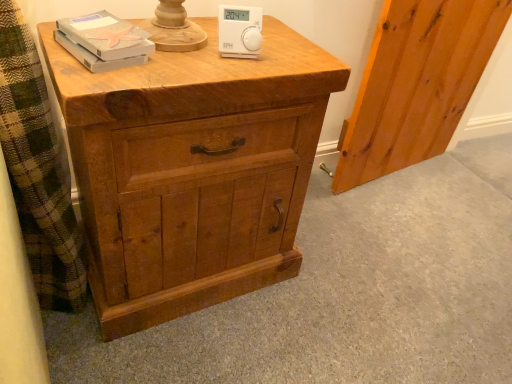
Question: Considering the relative sizes of matte gray book at upper left and white plastic thermostat at upper center in the image provided, is matte gray book at upper left shorter than white plastic thermostat at upper center?

Choices:
 (A) no
 (B) yes

Answer: (B)

Question: From a real-world perspective, is matte gray book at upper left located higher than white plastic thermostat at upper center?

Choices:
 (A) yes
 (B) no

Answer: (B)

Question: From the image's perspective, is matte gray book at upper left located beneath white plastic thermostat at upper center?

Choices:
 (A) no
 (B) yes

Answer: (B)

Question: Considering the relative sizes of matte gray book at upper left and white plastic thermostat at upper center in the image provided, is matte gray book at upper left thinner than white plastic thermostat at upper center?

Choices:
 (A) no
 (B) yes

Answer: (A)

Question: Considering the relative sizes of matte gray book at upper left and white plastic thermostat at upper center in the image provided, is matte gray book at upper left taller than white plastic thermostat at upper center?

Choices:
 (A) no
 (B) yes

Answer: (A)

Question: Considering the relative positions of matte gray book at upper left and natural wood screen door at right in the image provided, is matte gray book at upper left to the left or to the right of natural wood screen door at right?

Choices:
 (A) right
 (B) left

Answer: (B)

Question: From a real-world perspective, is matte gray book at upper left positioned above or below natural wood screen door at right?

Choices:
 (A) below
 (B) above

Answer: (B)

Question: From their relative heights in the image, would you say matte gray book at upper left is taller or shorter than natural wood screen door at right?

Choices:
 (A) short
 (B) tall

Answer: (A)

Question: Looking at their shapes, would you say matte gray book at upper left is wider or thinner than natural wood screen door at right?

Choices:
 (A) wide
 (B) thin

Answer: (A)

Question: Based on their positions, is matte gray book at upper left located to the left or right of natural wood chest of drawers at center?

Choices:
 (A) right
 (B) left

Answer: (B)

Question: Is point (119, 38) positioned closer to the camera than point (110, 178)?

Choices:
 (A) closer
 (B) farther

Answer: (A)

Question: From the image's perspective, is matte gray book at upper left located above or below natural wood chest of drawers at center?

Choices:
 (A) below
 (B) above

Answer: (B)

Question: Looking at the image, does matte gray book at upper left seem bigger or smaller compared to natural wood chest of drawers at center?

Choices:
 (A) big
 (B) small

Answer: (B)

Question: Is natural wood screen door at right to the left or to the right of matte gray book at upper left in the image?

Choices:
 (A) left
 (B) right

Answer: (B)

Question: Choose the correct answer: Is natural wood screen door at right inside matte gray book at upper left or outside it?

Choices:
 (A) inside
 (B) outside

Answer: (B)